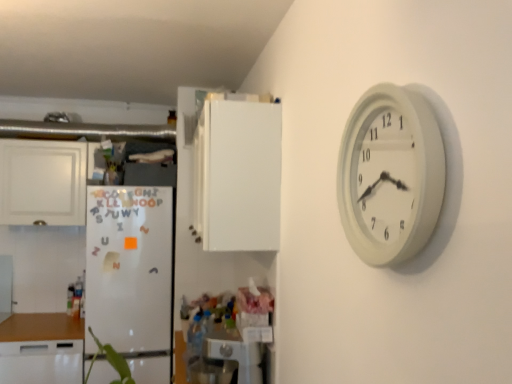
Question: Looking at their shapes, would you say white matte cabinet at center, arranged as the first cabinetry when viewed from the right, is wider or thinner than white matte refrigerator at left?

Choices:
 (A) wide
 (B) thin

Answer: (B)

Question: Is white matte cabinet at center, arranged as the first cabinetry when viewed from the right, in front of or behind white matte refrigerator at left in the image?

Choices:
 (A) front
 (B) behind

Answer: (A)

Question: Which object is positioned farthest from the white matte refrigerator at left?

Choices:
 (A) white matte cabinet at left, marked as the 2th cabinetry in a front-to-back arrangement
 (B) white matte cabinet at center, acting as the second cabinetry starting from the back
 (C) metallic silver appliance at lower center
 (D) white plastic wall clock at upper right

Answer: (D)

Question: Considering the real-world distances, which object is closest to the white matte refrigerator at left?

Choices:
 (A) metallic silver appliance at lower center
 (B) white plastic wall clock at upper right
 (C) white matte cabinet at left, which is the first cabinetry from back to front
 (D) white matte cabinet at center, arranged as the first cabinetry when viewed from the front

Answer: (C)